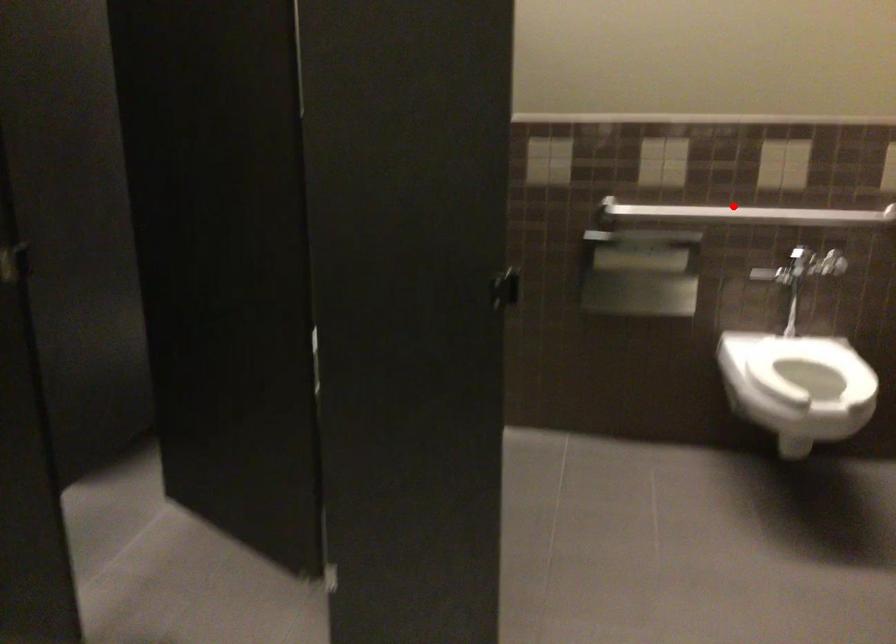
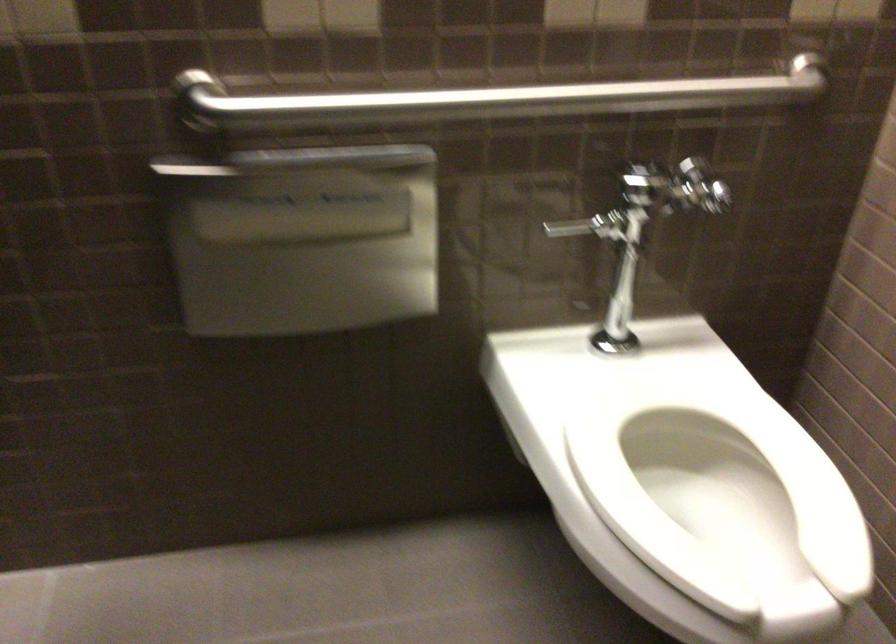
Question: I am providing you with two images of the same scene from different viewpoints. In image1, a red point is highlighted. Considering the same 3D point in image2, which of the following is correct?

Choices:
 (A) It is closer
 (B) It is farther

Answer: (A)